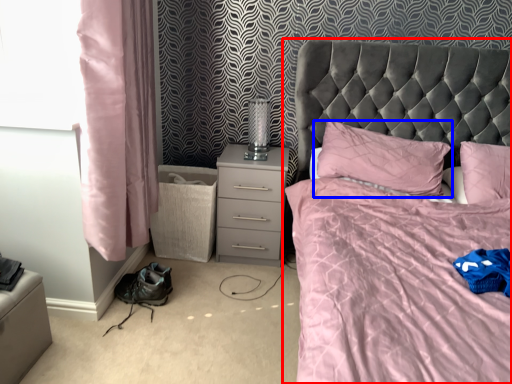
Question: Which point is further to the camera, bed (highlighted by a red box) or pillow (highlighted by a blue box)?

Choices:
 (A) bed
 (B) pillow

Answer: (B)